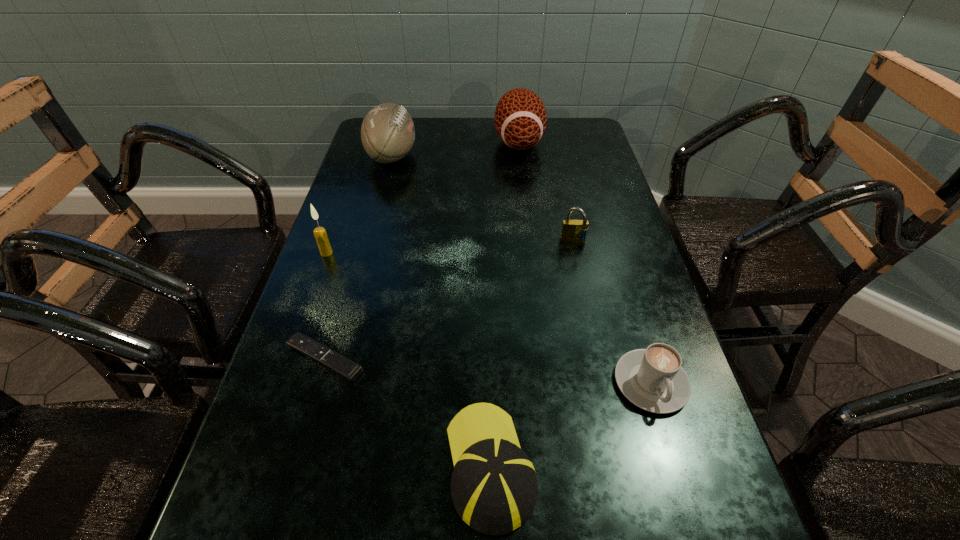
Identify the location of free space between the left football (American) and the right football (American). (455, 149).

This screenshot has height=540, width=960. I want to click on free spot between the remote control and the candle, so click(x=325, y=306).

This screenshot has width=960, height=540. Identify the location of free space between the shortest object and the cappuccino. (488, 370).

Find the location of a particular element. free space between the remote control and the cappuccino is located at coordinates (488, 370).

This screenshot has height=540, width=960. I want to click on vacant space that's between the baseball cap and the candle, so click(x=408, y=359).

The image size is (960, 540). Identify the location of blank region between the left football (American) and the fourth nearest object. (359, 205).

Select which object appears as the fourth closest to the remote control. Please provide its 2D coordinates. Your answer should be formatted as a tuple, i.e. [(x, y)], where the tuple contains the x and y coordinates of a point satisfying the conditions above.

[(572, 230)]

You are a GUI agent. You are given a task and a screenshot of the screen. Output one action in this format:
    pyautogui.click(x=<x>, y=<y>)
    Task: Click on the fifth closest object to the shortest object
    Image resolution: width=960 pixels, height=540 pixels.
    Given the screenshot: What is the action you would take?
    pyautogui.click(x=387, y=132)

The width and height of the screenshot is (960, 540). I want to click on vacant area in the image that satisfies the following two spatial constraints: 1. on the laces of the left football (American); 2. on the front side of the fourth nearest object, so click(x=367, y=253).

This screenshot has width=960, height=540. I want to click on free point that satisfies the following two spatial constraints: 1. on the laces of the left football (American); 2. on the front side of the candle, so click(x=367, y=253).